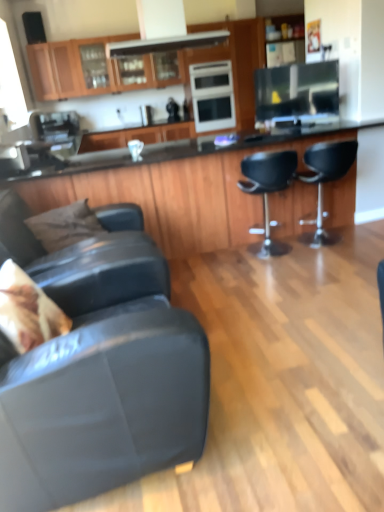
Question: Does wooden cabinets at upper center appear on the right side of brown fabric pillow at left, acting as the second pillow starting from the front?

Choices:
 (A) no
 (B) yes

Answer: (A)

Question: Is wooden cabinets at upper center oriented towards brown fabric pillow at left, positioned as the 2th pillow in bottom-to-top order?

Choices:
 (A) yes
 (B) no

Answer: (B)

Question: From a real-world perspective, is wooden cabinets at upper center on top of brown fabric pillow at left, the first pillow from the top?

Choices:
 (A) no
 (B) yes

Answer: (B)

Question: Does wooden cabinets at upper center have a larger size compared to brown fabric pillow at left, which is counted as the first pillow, starting from the back?

Choices:
 (A) no
 (B) yes

Answer: (B)

Question: Can you confirm if wooden cabinets at upper center is shorter than brown fabric pillow at left, acting as the second pillow starting from the front?

Choices:
 (A) yes
 (B) no

Answer: (B)

Question: Considering the relative sizes of wooden cabinets at upper center and brown fabric pillow at left, positioned as the 2th pillow in bottom-to-top order, in the image provided, is wooden cabinets at upper center wider than brown fabric pillow at left, positioned as the 2th pillow in bottom-to-top order,?

Choices:
 (A) no
 (B) yes

Answer: (B)

Question: Is the position of fluffy beige pillow at lower left, placed as the 1th pillow when sorted from front to back, less distant than that of black glossy countertop at center?

Choices:
 (A) no
 (B) yes

Answer: (B)

Question: Can you confirm if fluffy beige pillow at lower left, placed as the 1th pillow when sorted from front to back, is bigger than black glossy countertop at center?

Choices:
 (A) no
 (B) yes

Answer: (A)

Question: Is fluffy beige pillow at lower left, placed as the 1th pillow when sorted from front to back, not near black glossy countertop at center?

Choices:
 (A) no
 (B) yes

Answer: (B)

Question: From a real-world perspective, is fluffy beige pillow at lower left, the 2th pillow when ordered from back to front, beneath black glossy countertop at center?

Choices:
 (A) no
 (B) yes

Answer: (A)

Question: From a real-world perspective, is fluffy beige pillow at lower left, which is the first pillow from bottom to top, physically above black glossy countertop at center?

Choices:
 (A) no
 (B) yes

Answer: (B)

Question: Is fluffy beige pillow at lower left, placed as the 1th pillow when sorted from front to back, shorter than black glossy countertop at center?

Choices:
 (A) no
 (B) yes

Answer: (B)

Question: Is sleek stainless steel oven at center, arranged as the 1th appliance when viewed from the back, with leather couch at lower left, positioned as the first chair in left-to-right order?

Choices:
 (A) no
 (B) yes

Answer: (A)